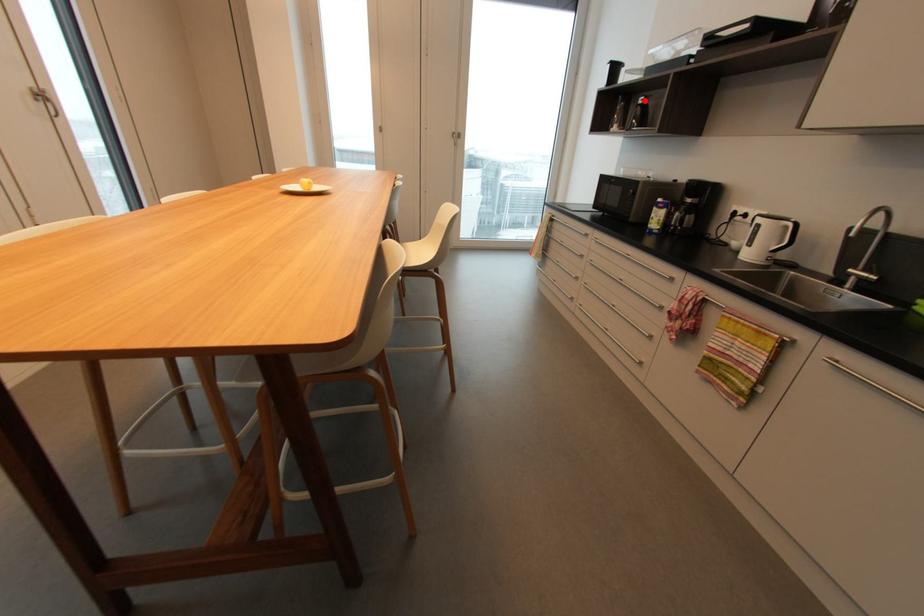
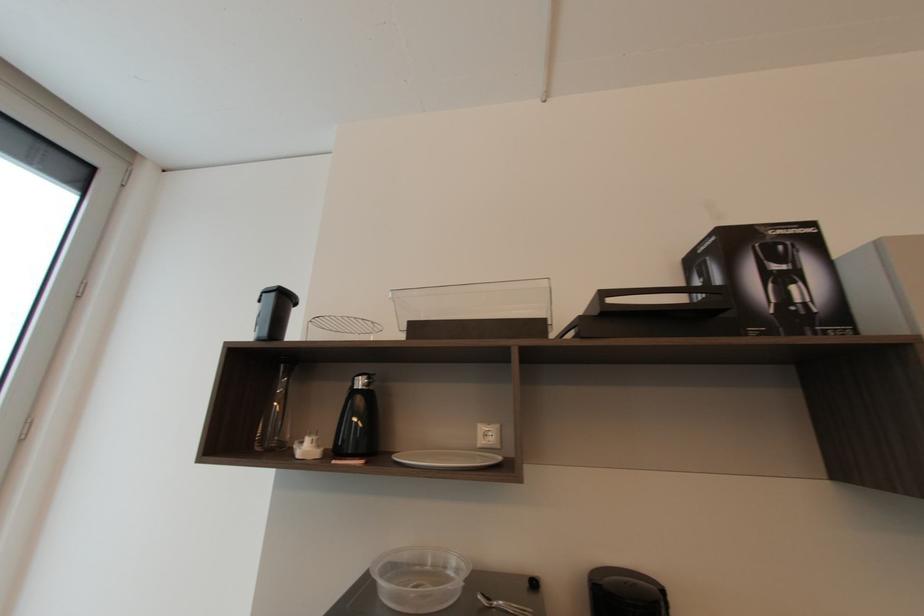
The point at the highlighted location is marked in the first image. Where is the corresponding point in the second image?

(362, 384)